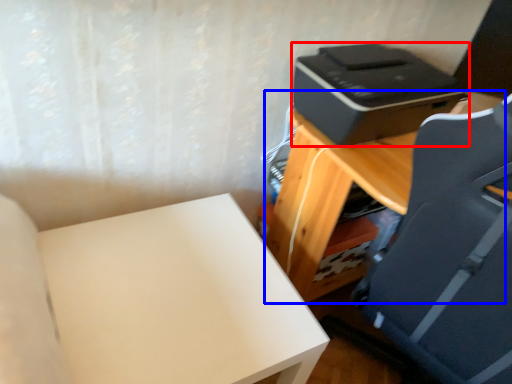
Question: Which object appears closest to the camera in this image, printer (highlighted by a red box) or table (highlighted by a blue box)?

Choices:
 (A) printer
 (B) table

Answer: (B)